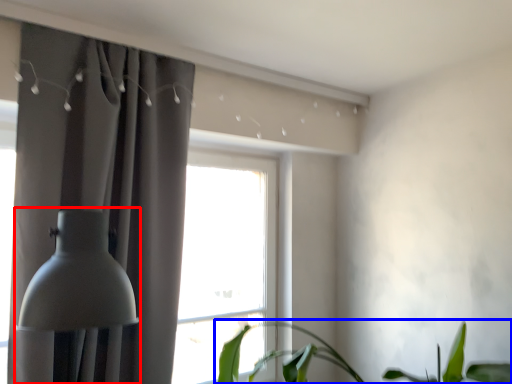
Question: Which point is closer to the camera, table lamp (highlighted by a red box) or houseplant (highlighted by a blue box)?

Choices:
 (A) table lamp
 (B) houseplant

Answer: (B)